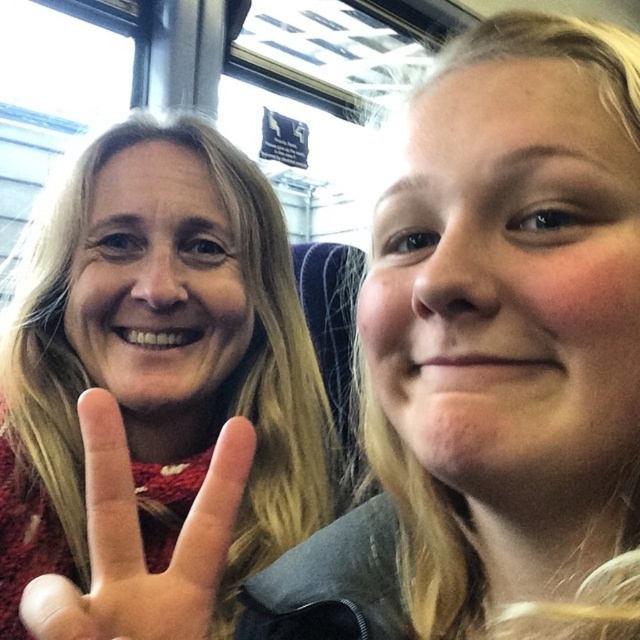
Question: Which point is farther to the camera?

Choices:
 (A) (52, 632)
 (B) (193, 237)

Answer: (B)

Question: Does matte red sweater at left appear on the right side of matte red sweater at lower left?

Choices:
 (A) no
 (B) yes

Answer: (A)

Question: Which point is farther to the camera?

Choices:
 (A) (216, 493)
 (B) (106, 636)

Answer: (A)

Question: Observing the image, what is the correct spatial positioning of matte red sweater at left in reference to matte red sweater at lower left?

Choices:
 (A) below
 (B) above

Answer: (A)

Question: Does matte red sweater at left appear on the right side of matte red sweater at lower left?

Choices:
 (A) no
 (B) yes

Answer: (A)